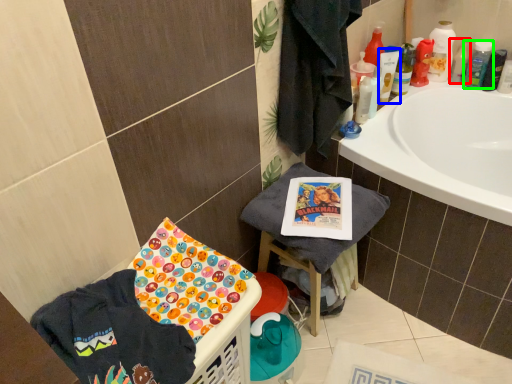
Question: Considering the real-world distances, which object is closest to cleaning product (highlighted by a red box)? mouthwash (highlighted by a blue box) or mouthwash (highlighted by a green box).

Choices:
 (A) mouthwash
 (B) mouthwash

Answer: (B)